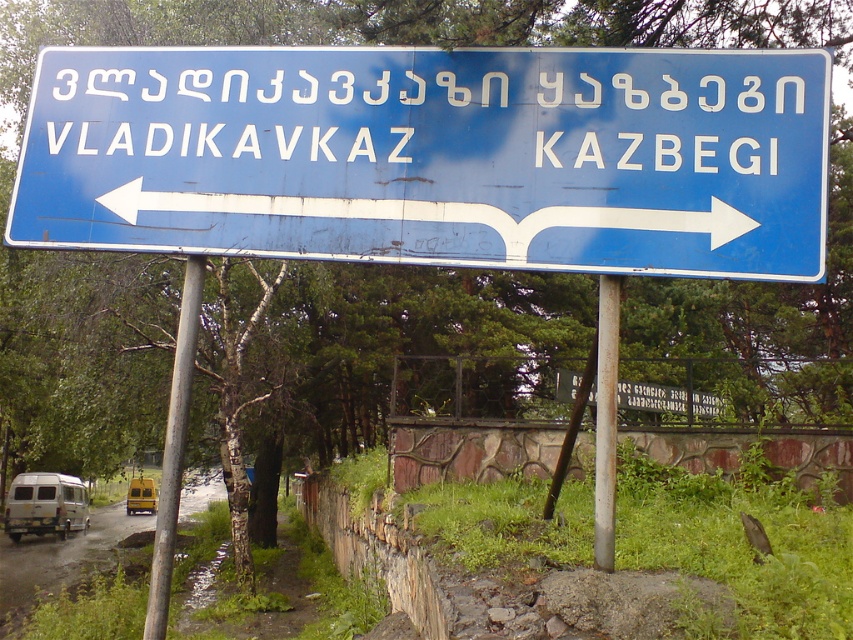
Question: Does metallic pole at left have a greater width compared to silver metallic pole at center?

Choices:
 (A) no
 (B) yes

Answer: (B)

Question: Does white glossy arrow at center have a greater width compared to silver metallic pole at center?

Choices:
 (A) yes
 (B) no

Answer: (A)

Question: Which of the following is the closest to the observer?

Choices:
 (A) metallic pole at left
 (B) white matte van at lower left
 (C) silver metallic pole at center
 (D) blue metallic sign at center

Answer: (D)

Question: Which object appears closest to the camera in this image?

Choices:
 (A) silver metallic pole at center
 (B) blue metallic sign at center
 (C) white matte van at lower left

Answer: (B)

Question: Does metallic pole at left have a larger size compared to white matte van at lower left?

Choices:
 (A) yes
 (B) no

Answer: (A)

Question: Which of the following is the farthest from the observer?

Choices:
 (A) silver metallic pole at center
 (B) yellow matte van at lower left

Answer: (B)